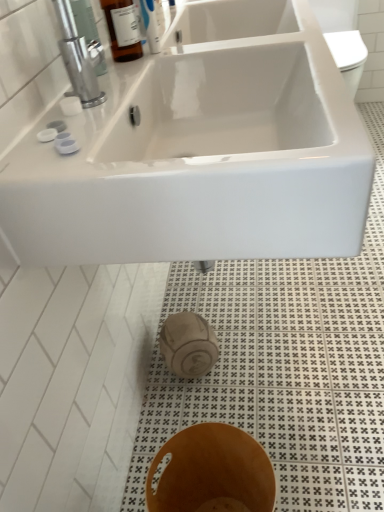
Question: Can we say brown wood bidet at lower center lies outside metallic silver faucet at upper left?

Choices:
 (A) yes
 (B) no

Answer: (A)

Question: Can you confirm if brown wood bidet at lower center is positioned to the right of metallic silver faucet at upper left?

Choices:
 (A) no
 (B) yes

Answer: (B)

Question: Can you confirm if brown wood bidet at lower center is bigger than metallic silver faucet at upper left?

Choices:
 (A) no
 (B) yes

Answer: (B)

Question: Can you see brown wood bidet at lower center touching metallic silver faucet at upper left?

Choices:
 (A) yes
 (B) no

Answer: (B)

Question: Considering the relative sizes of brown wood bidet at lower center and metallic silver faucet at upper left in the image provided, is brown wood bidet at lower center smaller than metallic silver faucet at upper left?

Choices:
 (A) yes
 (B) no

Answer: (B)

Question: Is brown wood bidet at lower center further to camera compared to metallic silver faucet at upper left?

Choices:
 (A) yes
 (B) no

Answer: (B)

Question: Is white glossy sink at upper center at the right side of brown wood bidet at lower center?

Choices:
 (A) no
 (B) yes

Answer: (B)

Question: Is white glossy sink at upper center wider than brown wood bidet at lower center?

Choices:
 (A) yes
 (B) no

Answer: (A)

Question: From the image's perspective, is white glossy sink at upper center over brown wood bidet at lower center?

Choices:
 (A) no
 (B) yes

Answer: (B)

Question: Is white glossy sink at upper center directly adjacent to brown wood bidet at lower center?

Choices:
 (A) no
 (B) yes

Answer: (A)

Question: Is white glossy sink at upper center far away from brown wood bidet at lower center?

Choices:
 (A) no
 (B) yes

Answer: (A)

Question: Is brown wood bidet at lower center a part of white glossy sink at upper center?

Choices:
 (A) yes
 (B) no

Answer: (B)

Question: Is metallic silver faucet at upper left bigger than brown wood bidet at lower center?

Choices:
 (A) yes
 (B) no

Answer: (B)